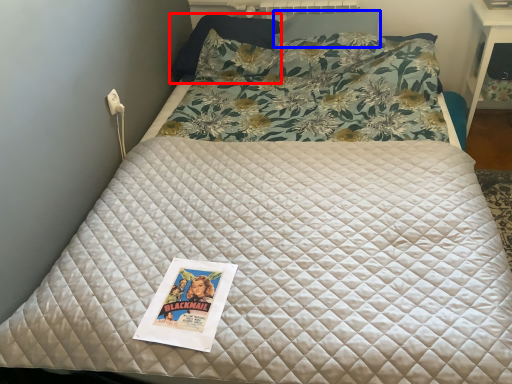
Question: Among these objects, which one is farthest to the camera, pillow (highlighted by a red box) or pillow (highlighted by a blue box)?

Choices:
 (A) pillow
 (B) pillow

Answer: (A)